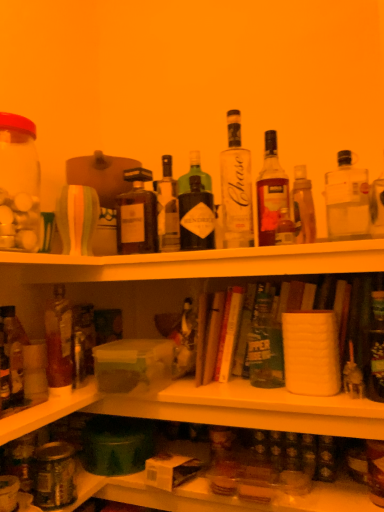
The width and height of the screenshot is (384, 512). Find the location of `free location to the left of green matte beer bottle at center, placed as the 5th bottle when sorted from right to left`. free location to the left of green matte beer bottle at center, placed as the 5th bottle when sorted from right to left is located at coordinates (222, 388).